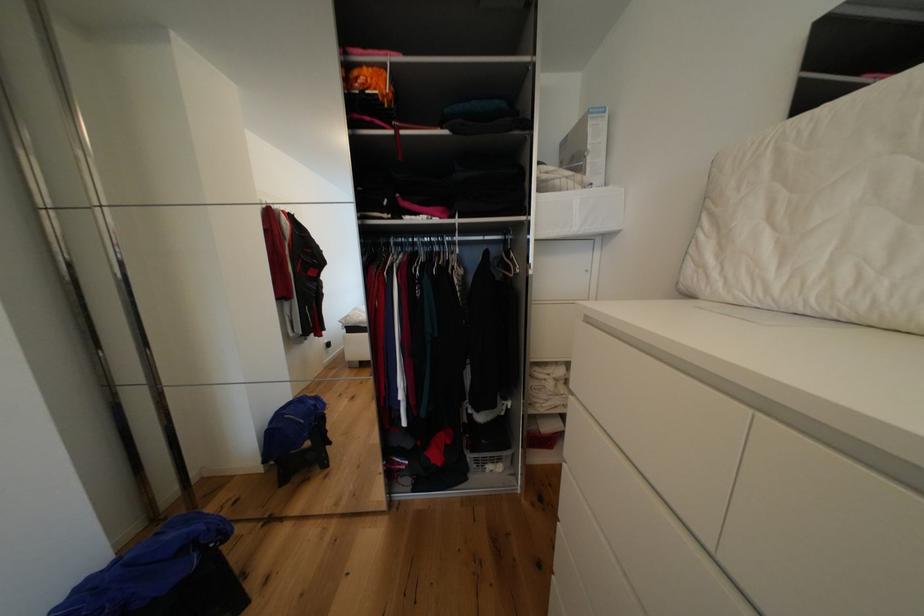
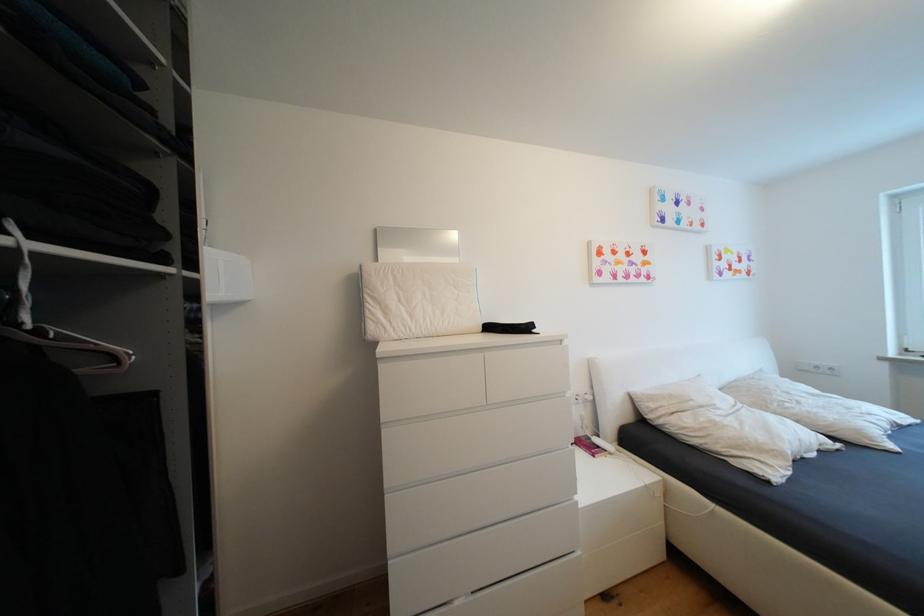
Question: How did the camera likely rotate?

Choices:
 (A) Left
 (B) Right
 (C) Up
 (D) Down

Answer: (B)